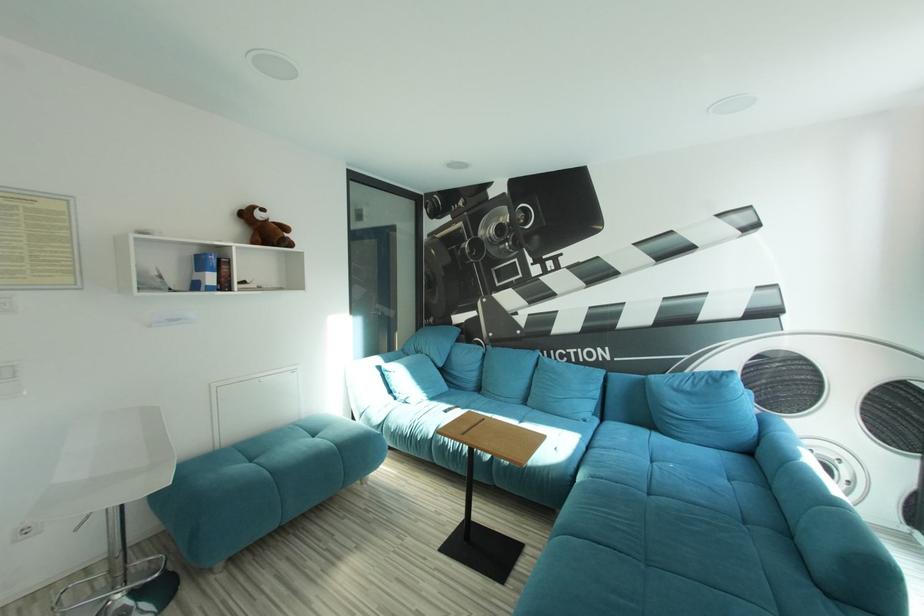
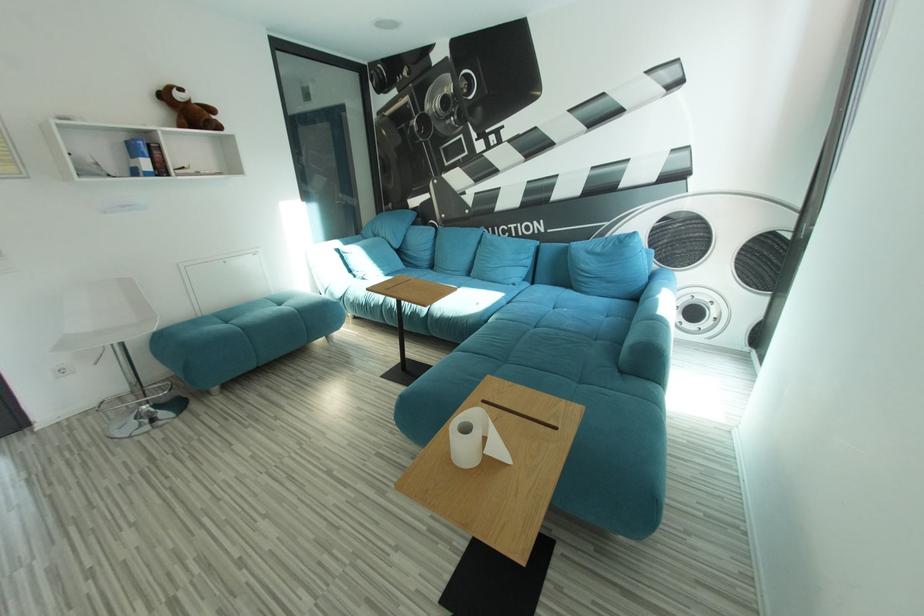
Question: Based on the continuous images, in which direction is the camera rotating? Reply with the corresponding letter.

Choices:
 (A) Left
 (B) Right
 (C) Up
 (D) Down

Answer: (D)